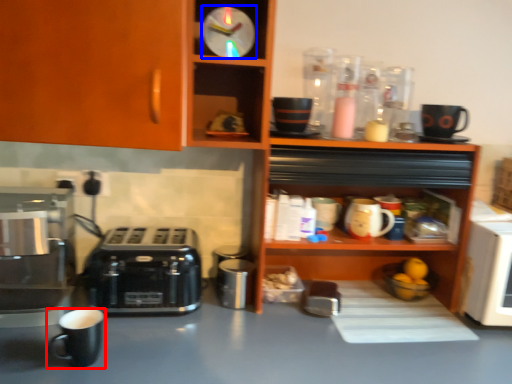
Question: Which of the following is the farthest to the observer, coffee cup (highlighted by a red box) or clock (highlighted by a blue box)?

Choices:
 (A) coffee cup
 (B) clock

Answer: (B)